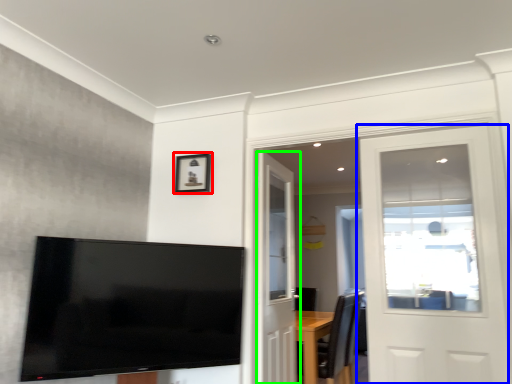
Question: Estimate the real-world distances between objects in this image. Which object is farther from picture frame (highlighted by a red box), door (highlighted by a blue box) or door (highlighted by a green box)?

Choices:
 (A) door
 (B) door

Answer: (A)